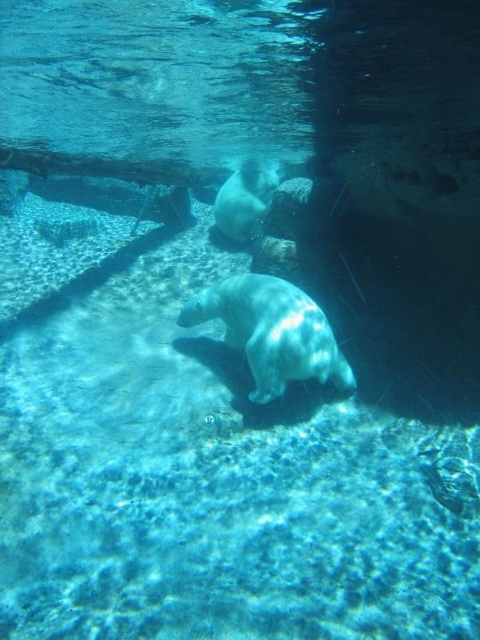
Is white smooth seal at center to the right of white smooth seal at upper center from the viewer's perspective?

Correct, you'll find white smooth seal at center to the right of white smooth seal at upper center.

Between point (286, 356) and point (275, 177), which one is positioned behind?

The point (275, 177) is more distant.

At what (x,y) coordinates should I click in order to perform the action: click on white smooth seal at center. Please return your answer as a coordinate pair (x, y). The width and height of the screenshot is (480, 640). Looking at the image, I should click on (272, 332).